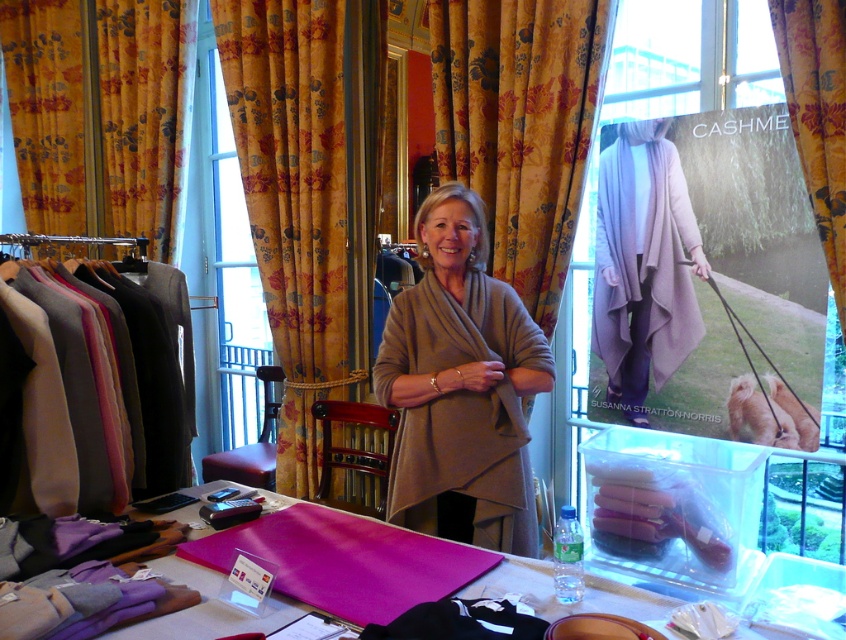
You are a customer in the store and want to reach the yellow floral fabric at upper left and the matte wool sweater at left. Which item is closer to the left side of the store?

The yellow floral fabric at upper left is closer to the left side of the store because it is positioned to the left of the matte wool sweater at left.

You are a photographer setting up a shot in the store. You have two points marked in the scene, point (272, 257) and point (188, 134). Which point should you focus on if you want to ensure the foreground element is sharp?

You should focus on point (272, 257) because it is closer to the camera than point (188, 134), making it the foreground element.

You are a customer in the store and want to see the beige woolen shawl at center. Since the yellow floral fabric curtain at center is blocking your view, can you move the curtain to get a better look?

The beige woolen shawl at center is located below the yellow floral fabric curtain at center, so you can move the curtain to see the shawl underneath.